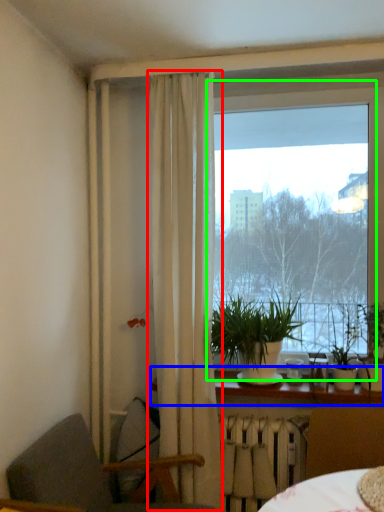
Question: Considering the real-world distances, which object is farthest from curtain (highlighted by a red box)? window sill (highlighted by a blue box) or window (highlighted by a green box)?

Choices:
 (A) window sill
 (B) window

Answer: (B)